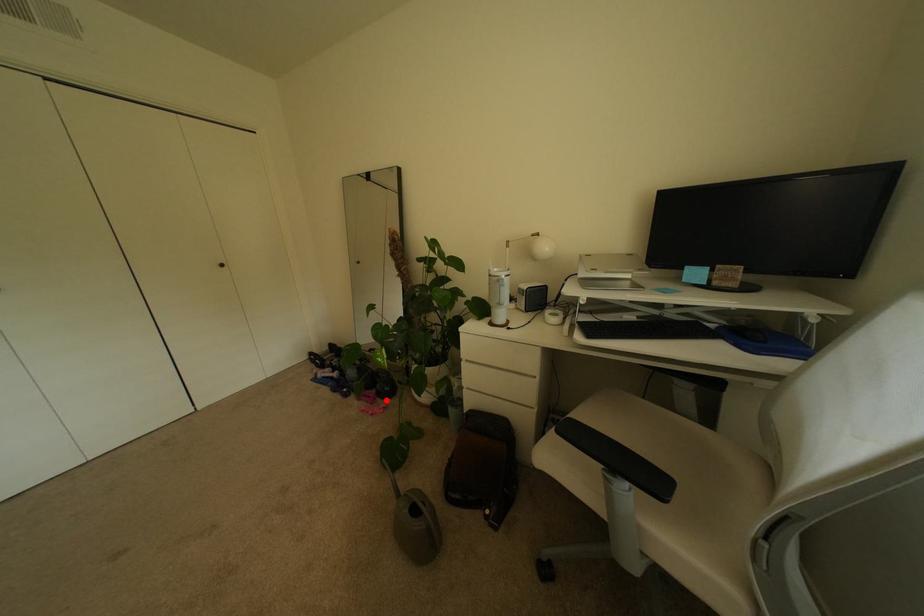
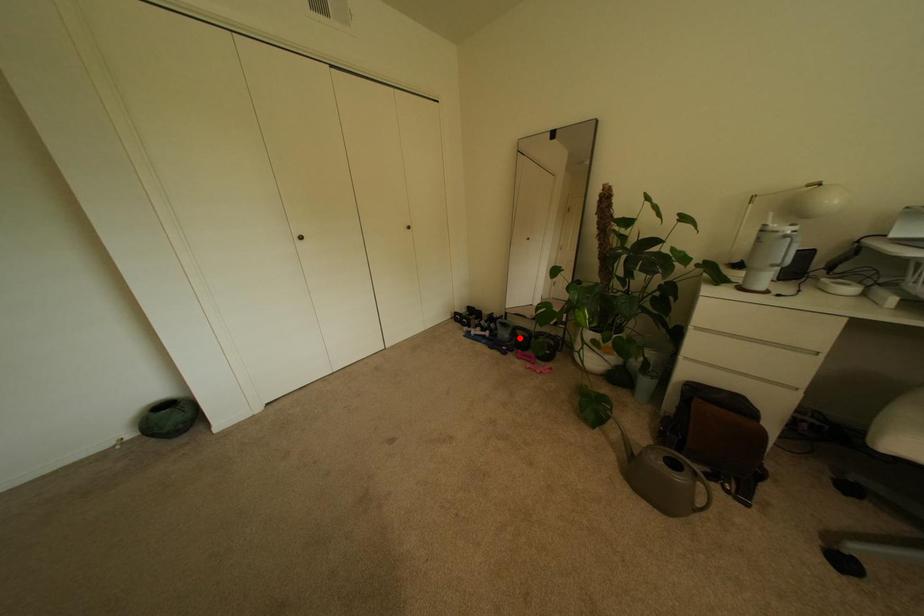
I am providing you with two images of the same scene from different viewpoints. A red point is marked on the first image and another point is marked on the second image. Are the points marked in image1 and image2 representing the same 3D position?

No